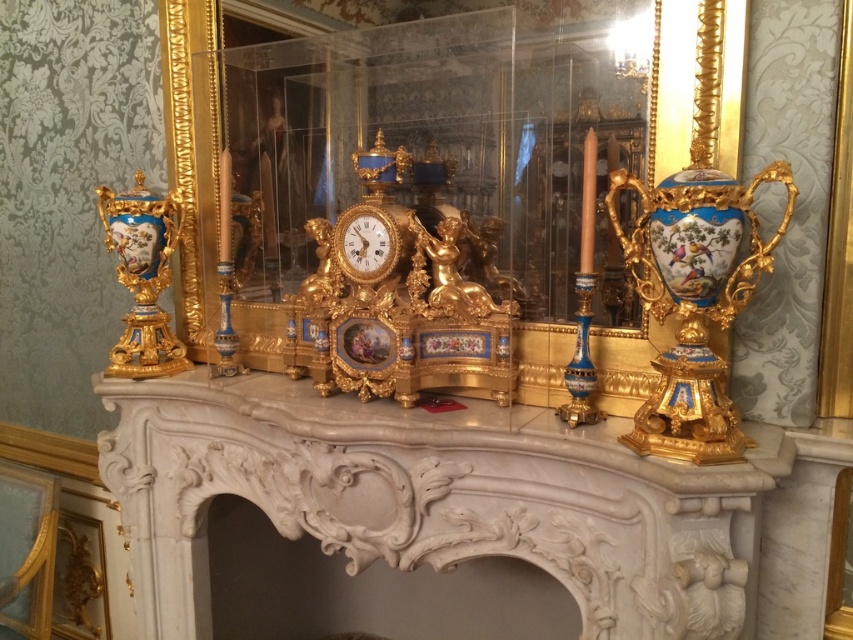
You are standing in front of the mantelpiece and want to place a new golden candlestick on the mantelpiece. The candlestick is 10 cm wide. There is a space at point (693, 298). Can you fit the candlestick there?

The space at point (693, 298) is occupied by the porcelain blue vase at right, so you cannot place the candlestick there.